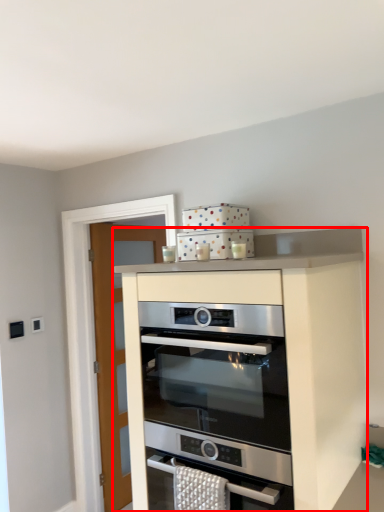
Question: From the image's perspective, where is cabinetry (annotated by the red box) located in relation to oven in the image?

Choices:
 (A) below
 (B) above

Answer: (A)